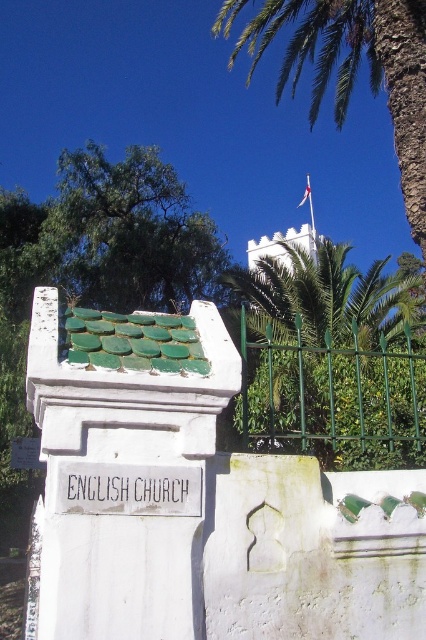
You are standing at the camera position and want to take a photo of the green leafy tree at upper left. If your camera has a maximum focus range of 60 feet, will you be able to focus on the tree?

The green leafy tree at upper left and camera are 68.17 feet apart, which exceeds the camera maximum focus range of 60 feet. Therefore, the camera cannot focus on the tree.

In the scene shown: You are an artist painting this scene. You need to decide which object to sketch first based on their size in the image. Which one should you start with, the green leafy tree at upper left or the white fabric flag at upper center?

The white fabric flag at upper center should be sketched first because it occupies more space in the image than the green leafy tree at upper left.